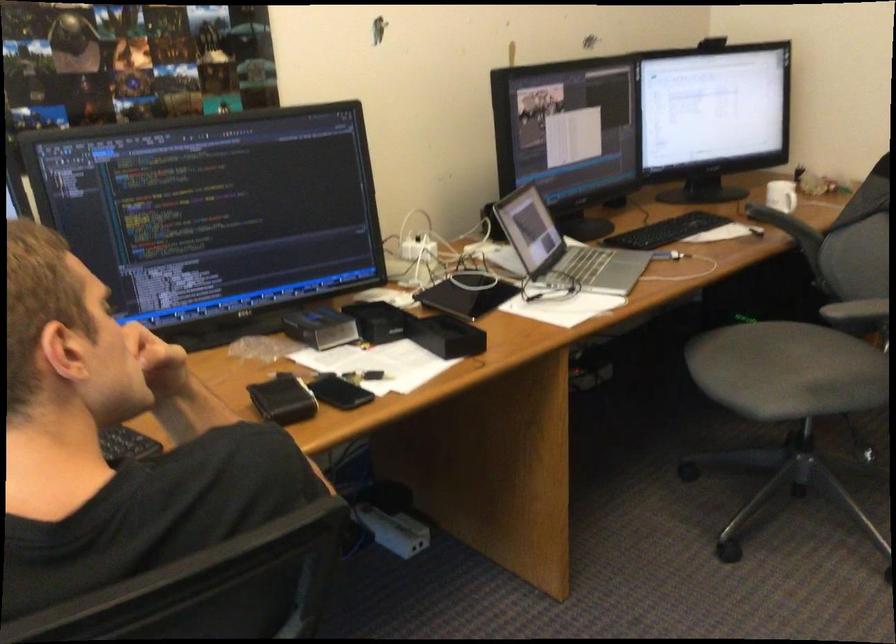
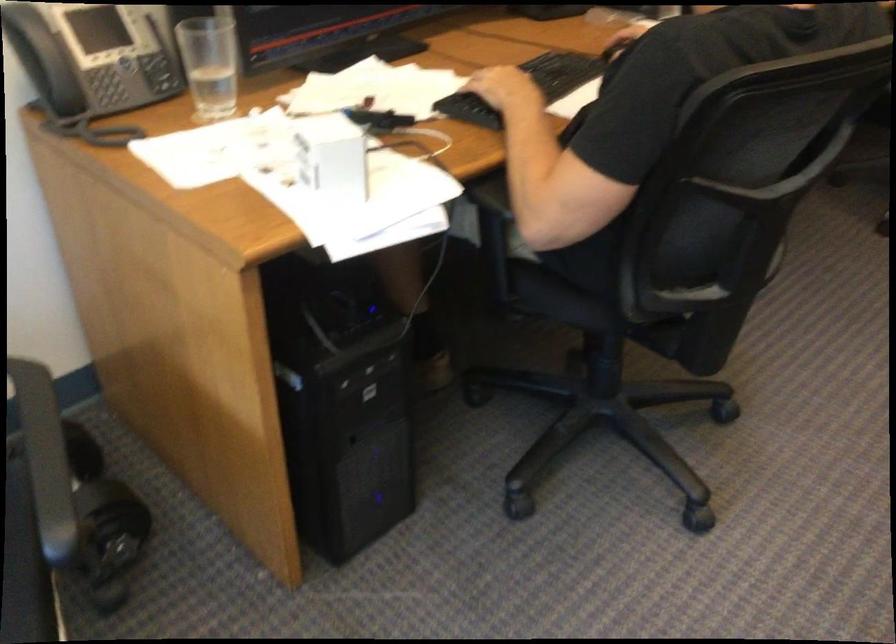
In a continuous first-person perspective shot, in which direction is the camera moving?

The cameraman moved toward left, backward.